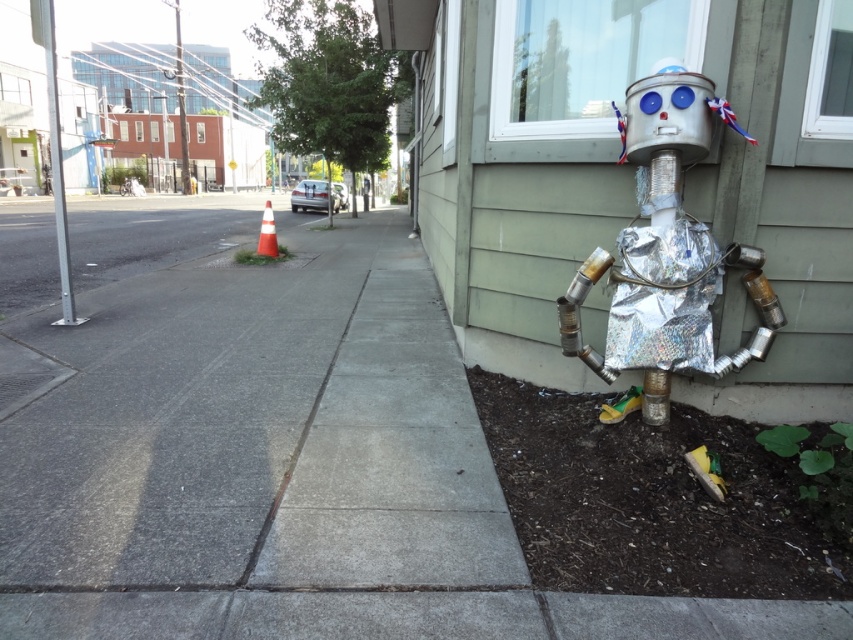
You are a gardener who needs to plant flowers in the area. Which location would you choose between the gray concrete sidewalk at center and the dark brown soil at lower right, and why?

The dark brown soil at lower right is the better choice for planting flowers because soil provides the necessary nutrients and space for plant growth, whereas concrete is hard and impenetrable for roots. Additionally, the gray concrete sidewalk at center is larger in size, but it is not suitable for planting.

Based on the photo, you are a delivery drone that needs to land on the gray concrete sidewalk at center. The holographic foil robot at lower right is in your landing path. Can you safely land without hitting the robot if your minimum safe distance is 6 feet?

The gray concrete sidewalk at center and holographic foil robot at lower right are 6.23 feet apart, so yes, you can safely land without hitting the robot since the distance is greater than the required 6 feet.